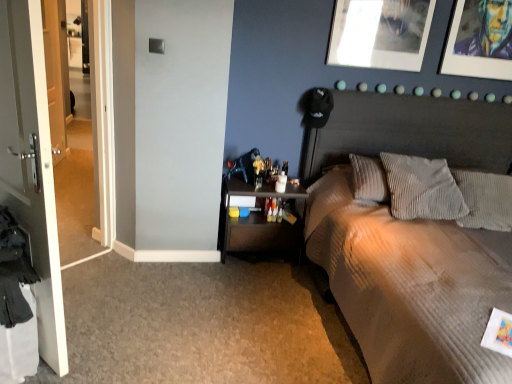
Locate an element on the screen. Image resolution: width=512 pixels, height=384 pixels. vacant area that lies to the right of white glossy door at left is located at coordinates (119, 337).